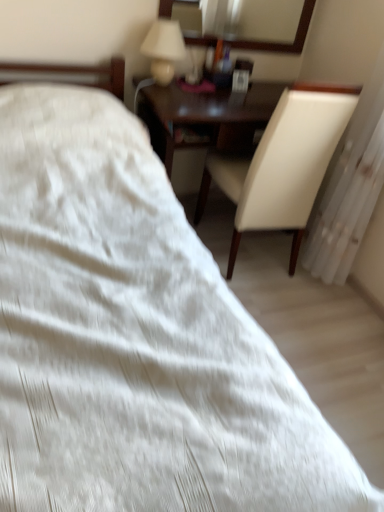
Question: Is white leather chair at right far from matte white lampshade at upper center?

Choices:
 (A) yes
 (B) no

Answer: (B)

Question: Is white leather chair at right smaller than matte white lampshade at upper center?

Choices:
 (A) no
 (B) yes

Answer: (A)

Question: Is white leather chair at right oriented away from matte white lampshade at upper center?

Choices:
 (A) yes
 (B) no

Answer: (B)

Question: Is white leather chair at right surrounding matte white lampshade at upper center?

Choices:
 (A) no
 (B) yes

Answer: (A)

Question: Does white leather chair at right have a lesser height compared to matte white lampshade at upper center?

Choices:
 (A) yes
 (B) no

Answer: (B)

Question: From the image's perspective, is white leather chair at right below matte white lampshade at upper center?

Choices:
 (A) no
 (B) yes

Answer: (B)

Question: From a real-world perspective, is wooden-framed mirror at upper center beneath white fabric radiator at right?

Choices:
 (A) yes
 (B) no

Answer: (B)

Question: From the image's perspective, is wooden-framed mirror at upper center located above white fabric radiator at right?

Choices:
 (A) no
 (B) yes

Answer: (B)

Question: Are wooden-framed mirror at upper center and white fabric radiator at right far apart?

Choices:
 (A) yes
 (B) no

Answer: (B)

Question: From the image's perspective, is wooden-framed mirror at upper center below white fabric radiator at right?

Choices:
 (A) no
 (B) yes

Answer: (A)

Question: Can you see wooden-framed mirror at upper center touching white fabric radiator at right?

Choices:
 (A) no
 (B) yes

Answer: (A)

Question: Is wooden-framed mirror at upper center positioned with its back to white fabric radiator at right?

Choices:
 (A) yes
 (B) no

Answer: (B)

Question: Is white fabric radiator at right behind white leather chair at right?

Choices:
 (A) no
 (B) yes

Answer: (A)